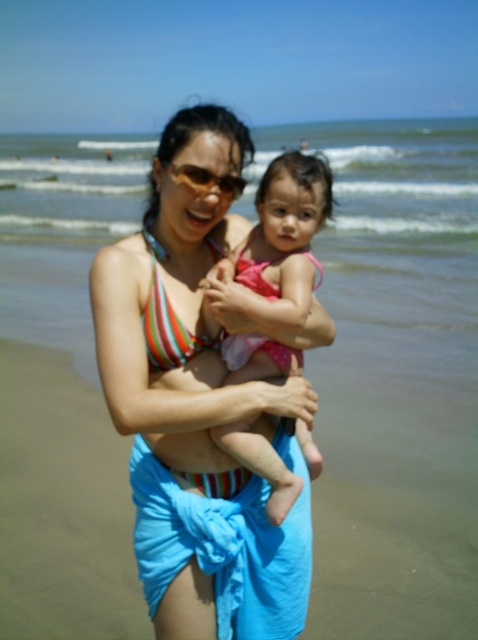
You are a photographer trying to capture the woman and child in the scene. You notice the striped bikini top at center and the pink fabric at center. Which one should you focus on if you want to highlight the lower part of the woman?

The striped bikini top at center is located below the pink fabric at center, so focusing on the striped bikini top at center would highlight the lower part of the woman.